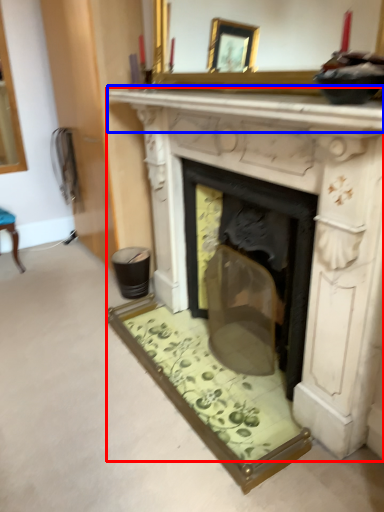
Question: Which point is closer to the camera, fireplace (highlighted by a red box) or mantle (highlighted by a blue box)?

Choices:
 (A) fireplace
 (B) mantle

Answer: (B)